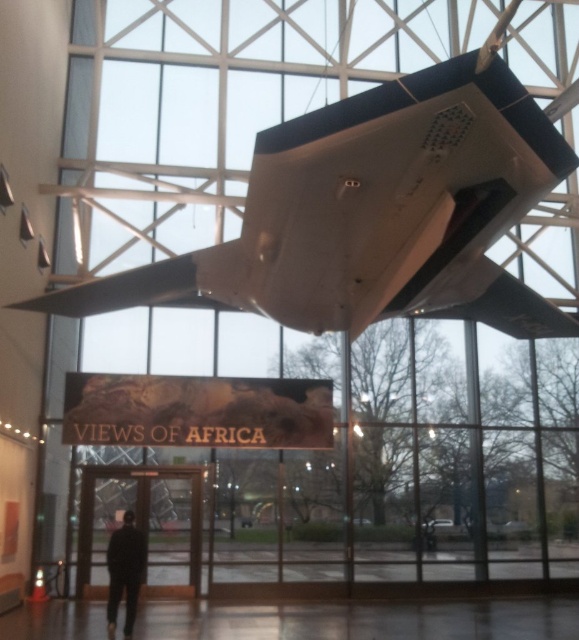
You are an architect designing a new exhibition space. You need to ensure that the white matte airplane at upper center and the black matte suit at lower left are visible from the entrance. Given their sizes, which object might require a more elevated display to ensure visibility?

The white matte airplane at upper center is larger in size than the black matte suit at lower left, so it might require a more elevated display to ensure visibility from the entrance.

You are standing in the museum and want to take a photo of the white matte airplane at upper center. If you position yourself directly below it, where would you stand relative to the airplane?

Since the white matte airplane at upper center is located at point 0.331 on the x axis and 0.649 on the y axis, positioning yourself directly below it would mean standing at the same x coordinate but lower y coordinate, so at approximately x 0.331, y 0.0.

You are an art curator planning to install a new sculpture in the exhibition hall. You need to place a new sculpture that is 2 meters tall between the white matte airplane at upper center and the black matte suit at lower left. Considering their positions, where should you place the sculpture so it doesn

The white matte airplane at upper center is above the black matte suit at lower left. Therefore, placing the sculpture between them would require positioning it below the white matte airplane at upper center and above the black matte suit at lower left to maintain spatial harmony.